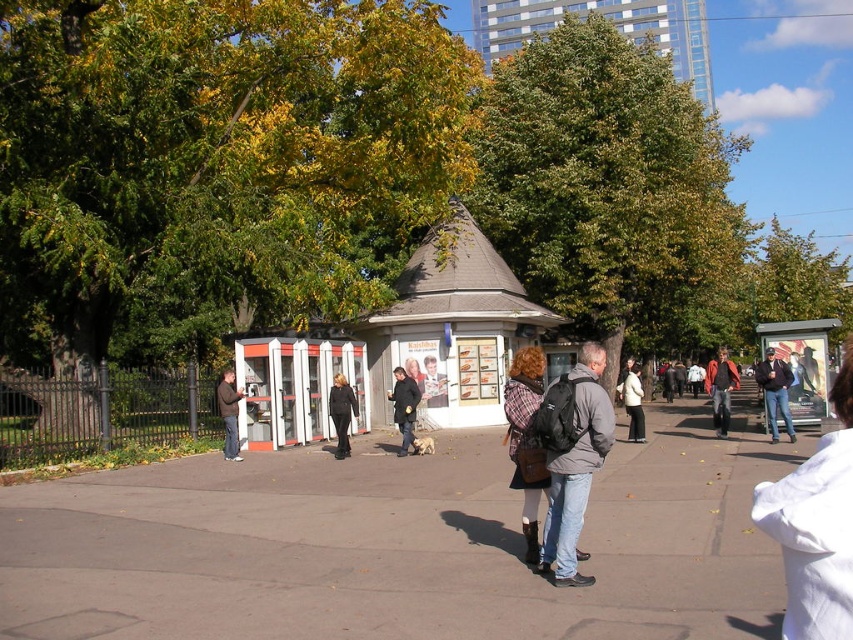
Can you confirm if black leather coat at center is shorter than plaid wool coat at center?

Incorrect, black leather coat at center's height does not fall short of plaid wool coat at center's.

Is point (339, 380) in front of point (664, 384)?

Yes, point (339, 380) is in front of point (664, 384).

Where is `black leather coat at center`? Image resolution: width=853 pixels, height=640 pixels. black leather coat at center is located at coordinates (341, 412).

Between metallic silver bus stop at center right and white sweater at center, which one appears on the right side from the viewer's perspective?

From the viewer's perspective, metallic silver bus stop at center right appears more on the right side.

The height and width of the screenshot is (640, 853). Describe the element at coordinates (802, 364) in the screenshot. I see `metallic silver bus stop at center right` at that location.

You are a GUI agent. You are given a task and a screenshot of the screen. Output one action in this format:
    pyautogui.click(x=<x>, y=<y>)
    Task: Click on the metallic silver bus stop at center right
    The height and width of the screenshot is (640, 853).
    Given the screenshot: What is the action you would take?
    tap(802, 364)

Does green leafy tree at upper left appear under matte black backpack at center?

No.

I want to click on green leafy tree at upper left, so click(215, 164).